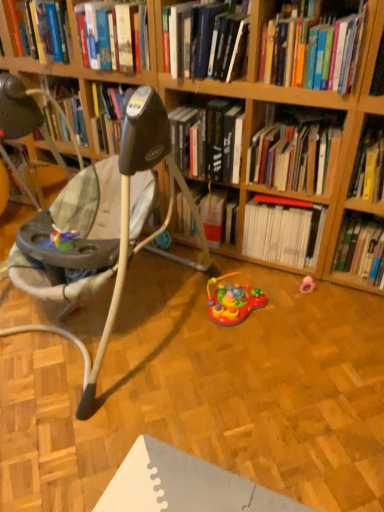
Find the location of a particular element. This screenshot has width=384, height=512. free spot to the left of multicolored plastic toy at center, marked as the second toy in a right-to-left arrangement is located at coordinates (179, 310).